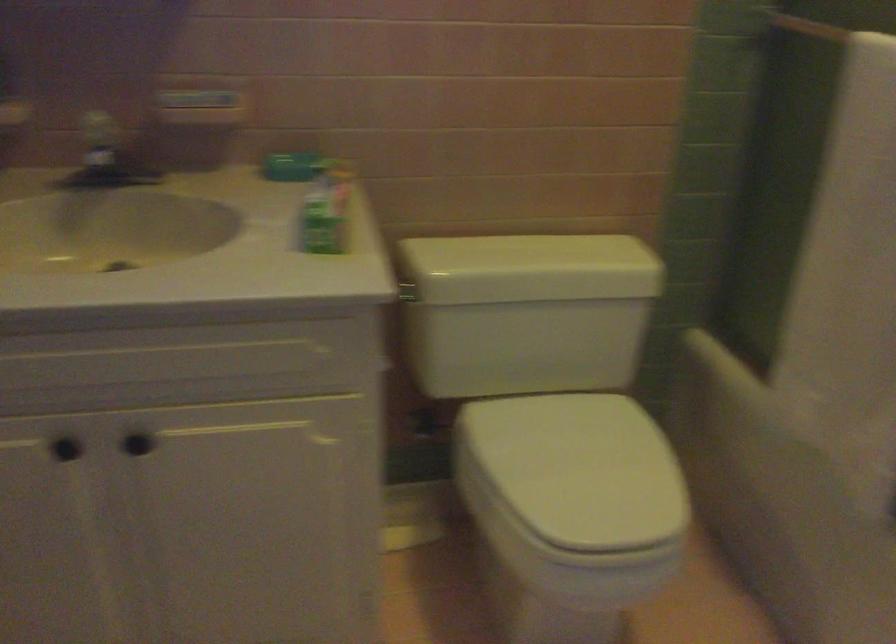
I want to click on white toilet seat lid, so click(x=579, y=468).